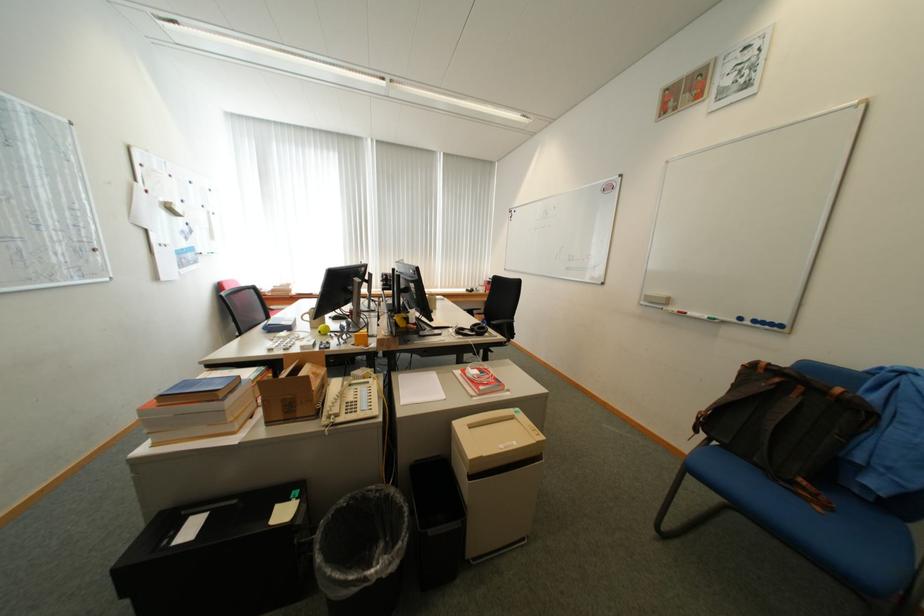
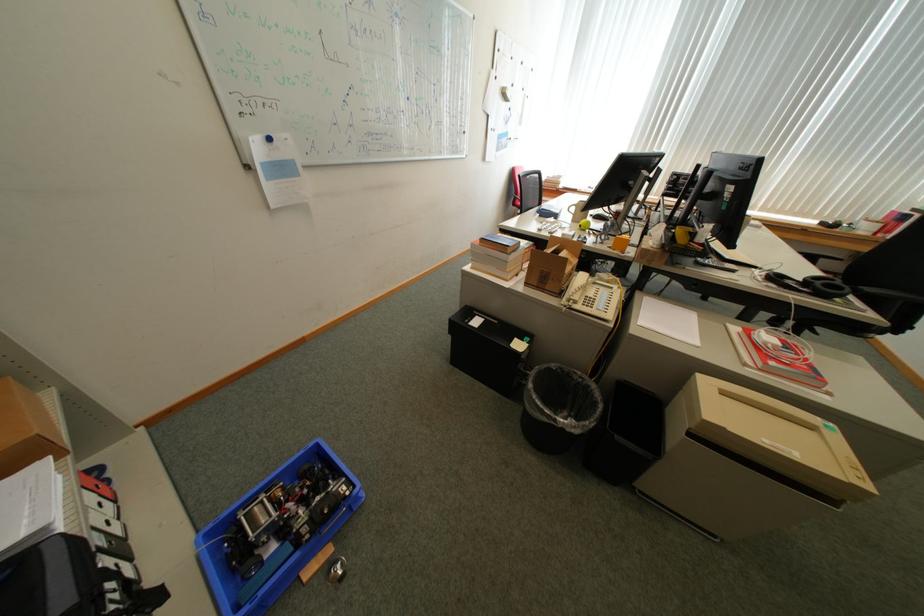
Where in the second image is the point corresponding to point (480, 313) from the first image?

(821, 260)